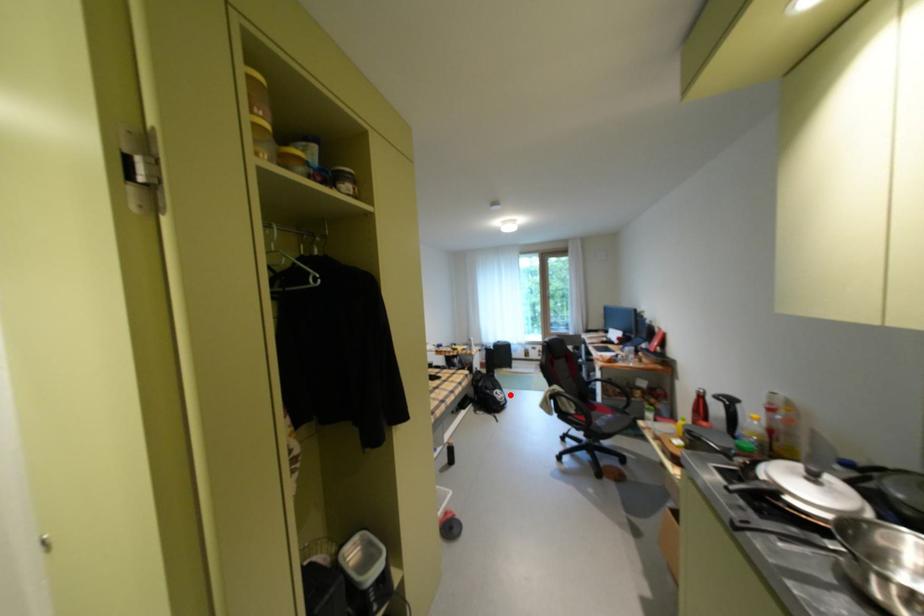
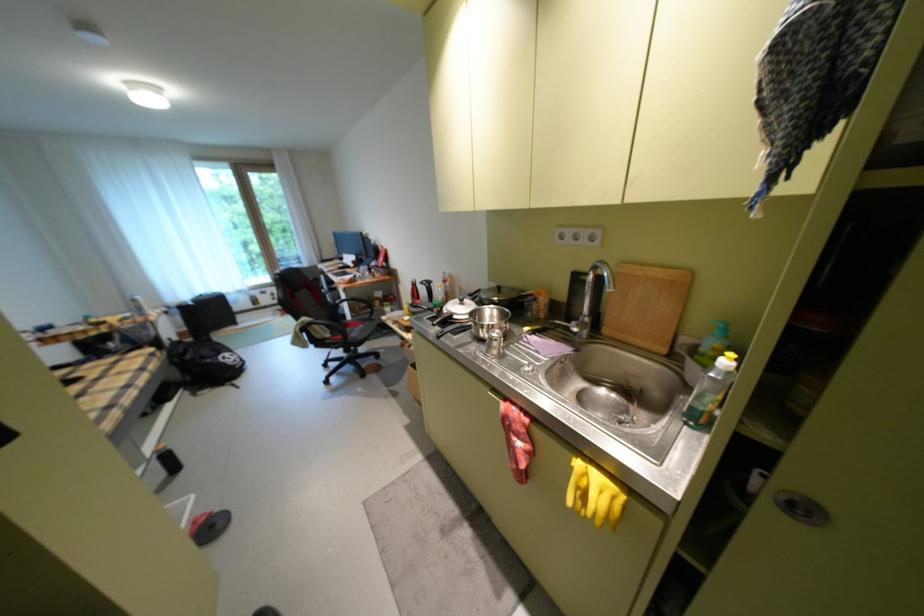
Question: I am providing you with two images of the same scene from different viewpoints. Image1 has a red point marked. In image2, the corresponding 3D location appears at what relative position? Reply with the corresponding letter.

Choices:
 (A) Closer
 (B) Farther

Answer: (A)